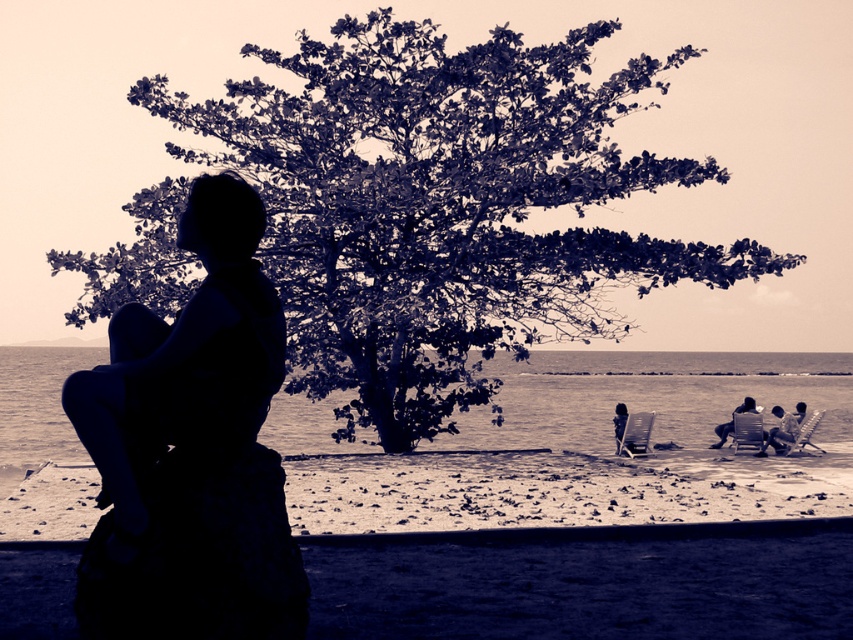
You are standing at the point marked by the coordinates point (440, 205). Looking towards the silhouette of the person sitting on the beach, which direction would you face?

The green leafy tree at center is represented by point 0.323, 018. Since the person is sitting facing away from the camera towards the sea, you would need to face away from the sea to look towards the person. Therefore, facing the opposite direction of the sea would allow you to see the silhouette of the person sitting on the beach.

You are a photographer setting up equipment on the beach. You notice two chairs, the smooth fabric chair at lower right and the smooth beige chair at lower right. Which chair is positioned higher up in the scene?

The smooth fabric chair at lower right is positioned higher up in the scene because it is located above the smooth beige chair at lower right.

You are a photographer wanting to capture the scene from the same angle. The green leafy tree at center and the sepia water at lower center are both in your viewfinder. Which object will appear larger in the photo?

The green leafy tree at center will appear larger in the photo because it is much taller than the sepia water at lower center.